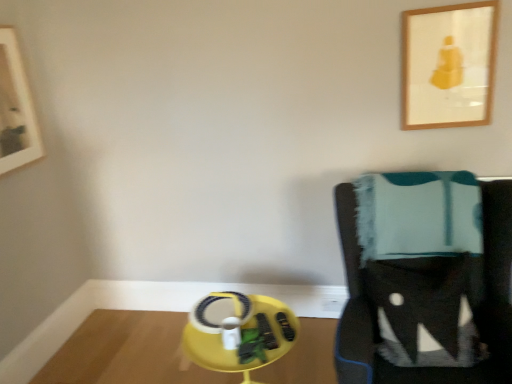
Question: Does point (461, 8) appear closer or farther from the camera than point (31, 109)?

Choices:
 (A) farther
 (B) closer

Answer: (B)

Question: Considering their positions, is wooden picture frame at upper right, the second picture frame when ordered from left to right, located in front of or behind wooden picture frame at upper left, positioned as the second picture frame in right-to-left order?

Choices:
 (A) front
 (B) behind

Answer: (A)

Question: Considering the real-world distances, which object is closest to the yellow plastic table at lower center?

Choices:
 (A) knitted wool blanket at right
 (B) yellow plastic round table at lower center
 (C) wooden picture frame at upper left, positioned as the second picture frame in right-to-left order
 (D) wooden picture frame at upper right, the second picture frame when ordered from left to right

Answer: (B)

Question: Considering the real-world distances, which object is closest to the yellow plastic table at lower center?

Choices:
 (A) wooden picture frame at upper left, positioned as the second picture frame in right-to-left order
 (B) yellow plastic round table at lower center
 (C) knitted wool blanket at right
 (D) wooden picture frame at upper right, the second picture frame when ordered from left to right

Answer: (B)